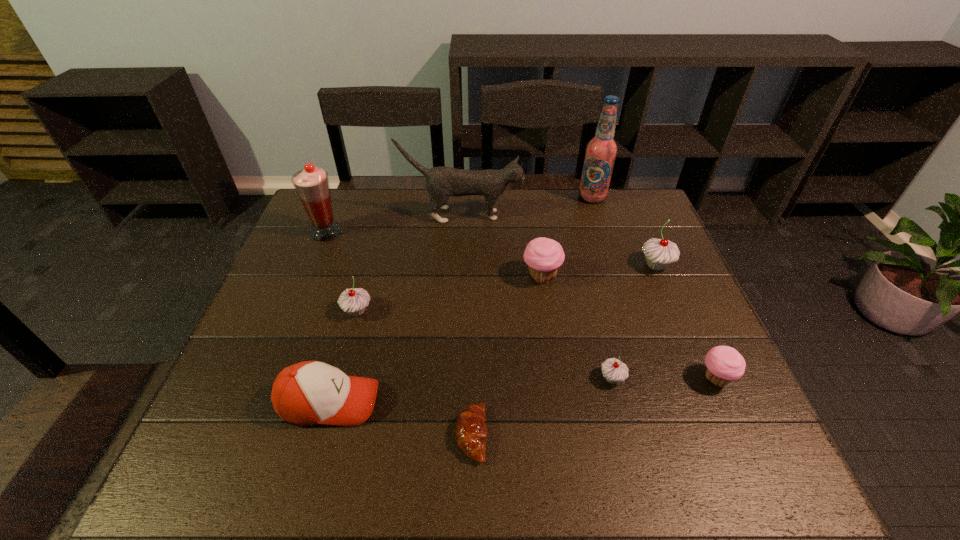
The height and width of the screenshot is (540, 960). Identify the location of the tallest object. (601, 151).

Image resolution: width=960 pixels, height=540 pixels. I want to click on the eighth object from left to right, so click(x=601, y=151).

Where is `cat`? This screenshot has height=540, width=960. cat is located at coordinates [x=442, y=182].

The width and height of the screenshot is (960, 540). In order to click on red smoothie in this screenshot , I will do `click(312, 186)`.

What are the coordinates of `the rightmost gray cupcake` in the screenshot? It's located at (659, 253).

Locate an element on the screen. the tallest cupcake is located at coordinates (659, 253).

Image resolution: width=960 pixels, height=540 pixels. In order to click on the farther pink cupcake in this screenshot , I will do (544, 256).

Find the location of a particular element. Image resolution: width=960 pixels, height=540 pixels. the fourth cupcake from right to left is located at coordinates (544, 256).

Where is `the second biggest gray cupcake`? The image size is (960, 540). the second biggest gray cupcake is located at coordinates (354, 301).

What are the coordinates of `the third farthest cupcake` in the screenshot? It's located at (354, 301).